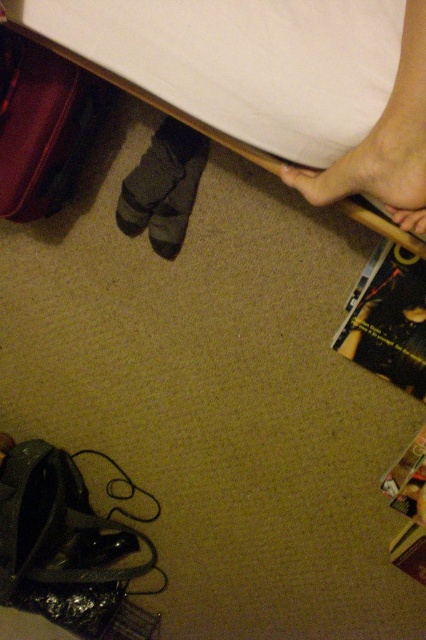
Question: In this image, where is dark gray fabric sock at lower center located relative to shiny metallic magazine at lower right?

Choices:
 (A) right
 (B) left

Answer: (B)

Question: Which object is closer to the camera taking this photo?

Choices:
 (A) black glossy magazine at lower right
 (B) white fabric bed at upper center
 (C) dark gray fabric sock at lower center

Answer: (B)

Question: Which of the following is the farthest from the observer?

Choices:
 (A) black glossy magazine at lower right
 (B) shiny metallic magazine at lower right
 (C) white fabric bed at upper center

Answer: (B)

Question: Is dark gray fabric sock at lower center positioned behind shiny metallic magazine at lower right?

Choices:
 (A) yes
 (B) no

Answer: (A)

Question: Does white fabric bed at upper center have a larger size compared to shiny metallic magazine at lower right?

Choices:
 (A) no
 (B) yes

Answer: (B)

Question: Which object is positioned farthest from the shiny metallic magazine at lower right?

Choices:
 (A) dark gray fabric sock at lower center
 (B) black glossy magazine at lower right

Answer: (A)